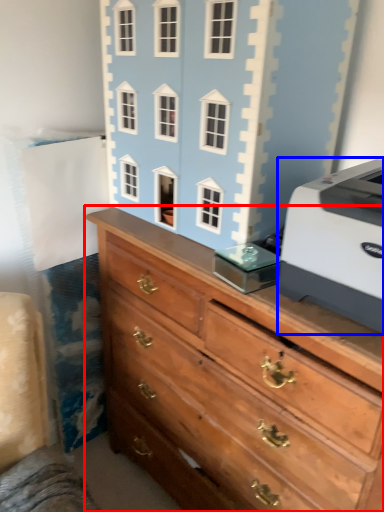
Question: Among these objects, which one is nearest to the camera, chest of drawers (highlighted by a red box) or printer (highlighted by a blue box)?

Choices:
 (A) chest of drawers
 (B) printer

Answer: (A)